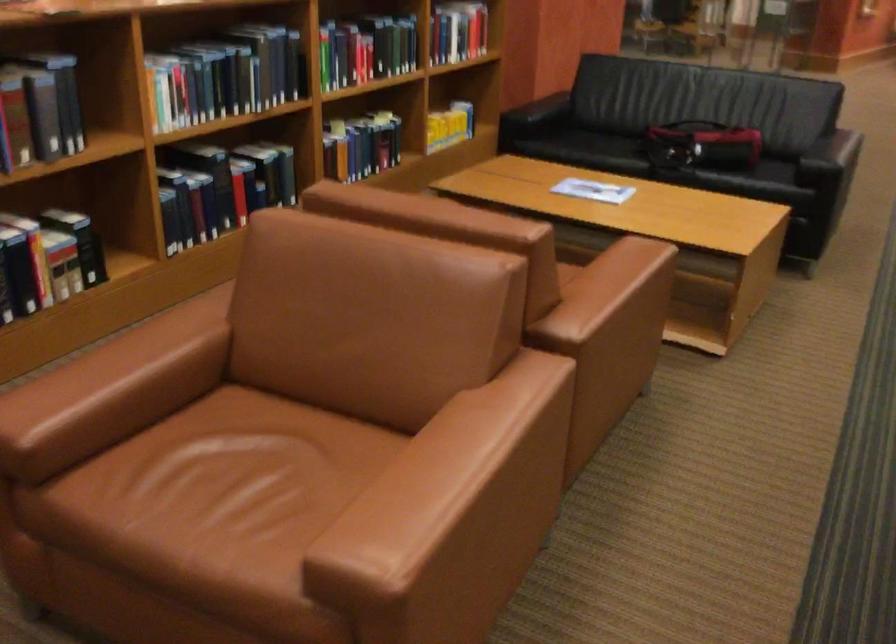
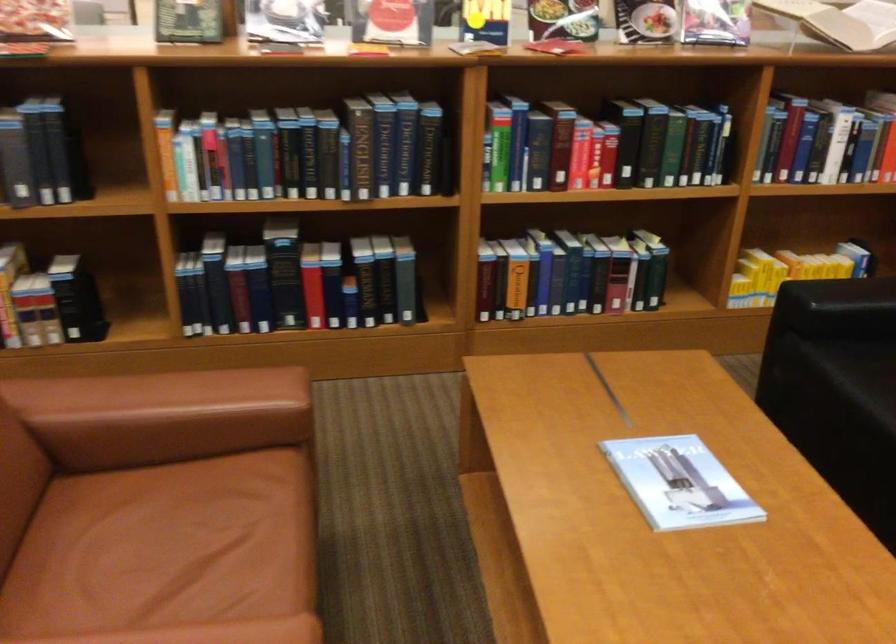
Find the pixel in the second image that matches point 233,75 in the first image.

(306, 152)